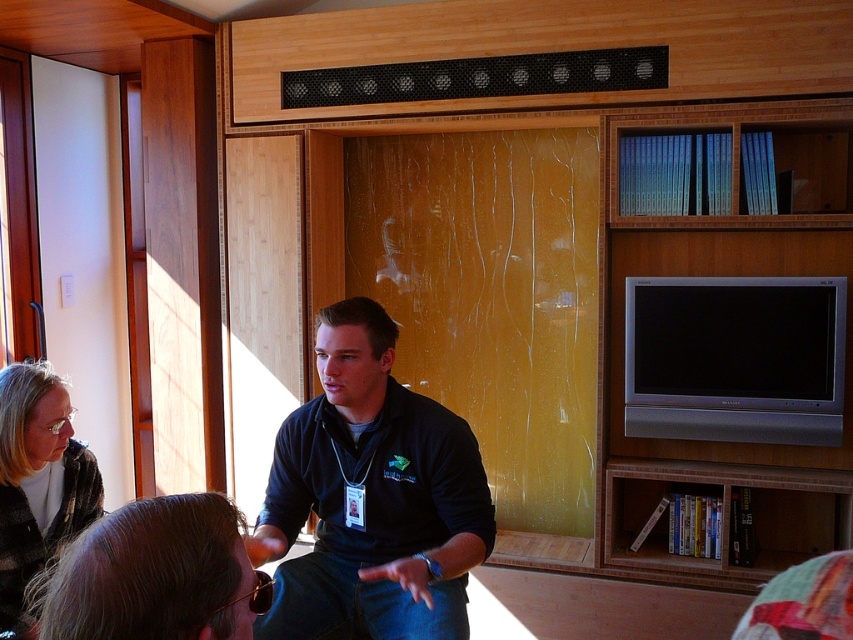
You are a photographer trying to capture a portrait of the black matte shirt at center and the brown hair at lower center. Which object should you focus on if you want to emphasize the larger one in the photo?

The black matte shirt at center has a larger size compared to brown hair at lower center, so you should focus on the black matte shirt at center to emphasize its larger size in the photo.

You are standing in the living room and see the black matte shirt at center and the matte black jacket at lower left. Which object is positioned more to the right side of the room?

The black matte shirt at center is positioned more to the right side of the room compared to the matte black jacket at lower left.